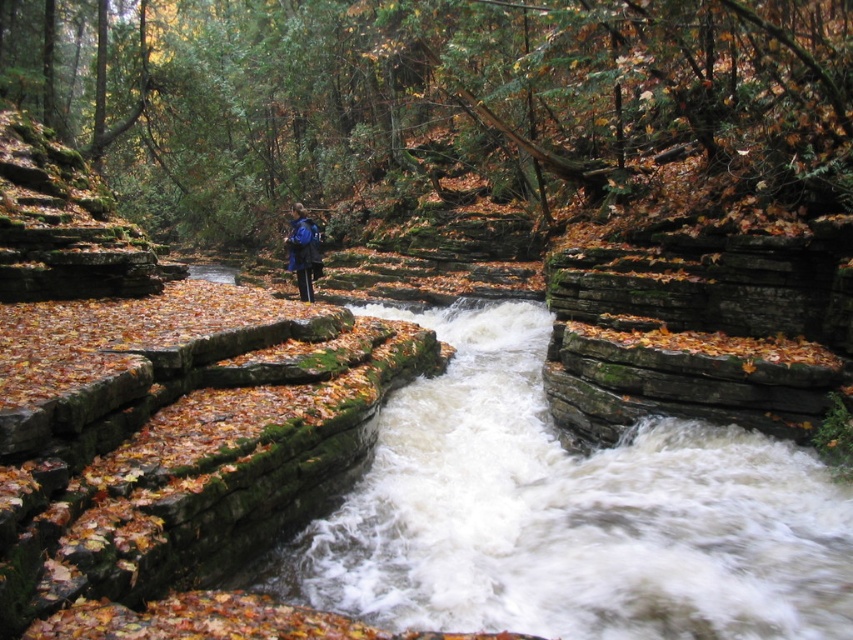
Question: Among these objects, which one is farthest from the camera?

Choices:
 (A) blue fabric backpack at center
 (B) brown stone stream at center

Answer: (A)

Question: Which point is closer to the camera?

Choices:
 (A) [x=415, y=435]
 (B) [x=231, y=26]

Answer: (A)

Question: Can you confirm if green mossy rocks at center is smaller than blue fabric backpack at center?

Choices:
 (A) yes
 (B) no

Answer: (B)

Question: Can you confirm if brown stone stream at center is positioned to the left of blue fabric backpack at center?

Choices:
 (A) yes
 (B) no

Answer: (B)

Question: Does green mossy rocks at center have a smaller size compared to blue fabric backpack at center?

Choices:
 (A) yes
 (B) no

Answer: (B)

Question: Which is farther from the blue fabric backpack at center?

Choices:
 (A) green mossy rocks at center
 (B) brown stone stream at center

Answer: (A)